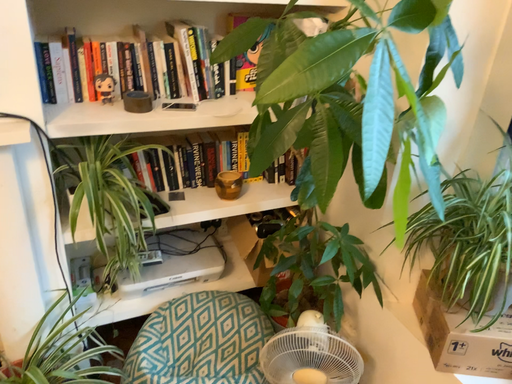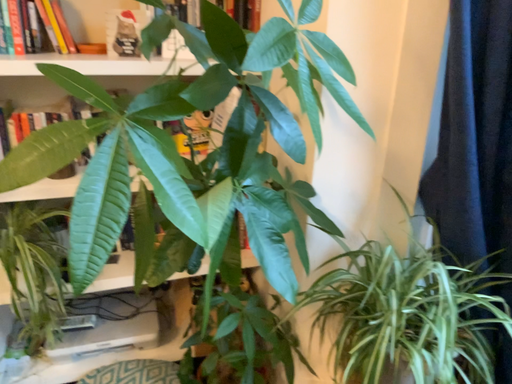
Question: How did the camera likely rotate when shooting the video?

Choices:
 (A) rotated downward
 (B) rotated upward

Answer: (B)